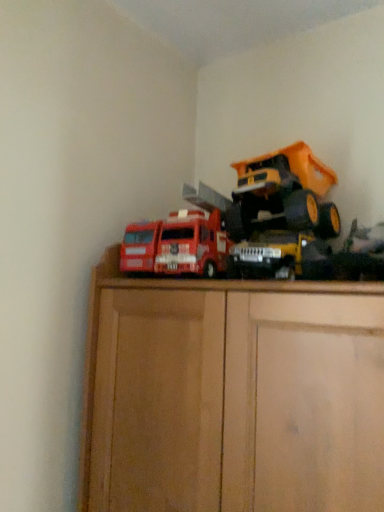
Question: Is metallic yellow dump truck at upper right, which ranks as the 1th toy in right-to-left order, wider or thinner than metallic yellow truck at center, the 2th toy in the right-to-left sequence?

Choices:
 (A) thin
 (B) wide

Answer: (B)

Question: From the image's perspective, relative to metallic yellow truck at center, the 2th toy in the right-to-left sequence, is metallic yellow dump truck at upper right, which appears as the 3th toy when viewed from the left, above or below?

Choices:
 (A) below
 (B) above

Answer: (B)

Question: Estimate the real-world distances between objects in this image. Which object is farther from the metallic yellow truck at center, marked as the 2th toy in a left-to-right arrangement?

Choices:
 (A) matte red truck at center, the third toy from the right
 (B) metallic yellow dump truck at upper right, which appears as the 3th toy when viewed from the left

Answer: (A)

Question: Which object is the farthest from the matte red truck at center, which is the 1th toy from left to right?

Choices:
 (A) metallic yellow dump truck at upper right, which appears as the 3th toy when viewed from the left
 (B) metallic yellow truck at center, marked as the 2th toy in a left-to-right arrangement

Answer: (A)